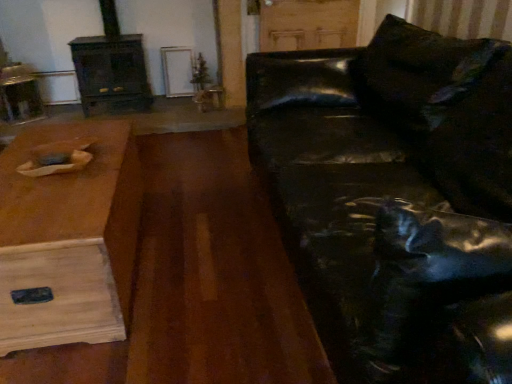
Find the location of a particular element. The width and height of the screenshot is (512, 384). free point to the right of wooden table at left is located at coordinates (205, 274).